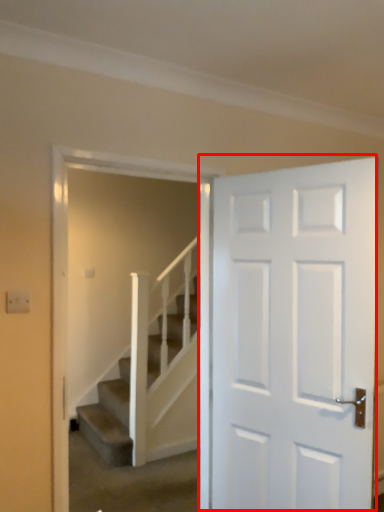
Question: From the image's perspective, where is door (annotated by the red box) located relative to stairs?

Choices:
 (A) above
 (B) below

Answer: (A)